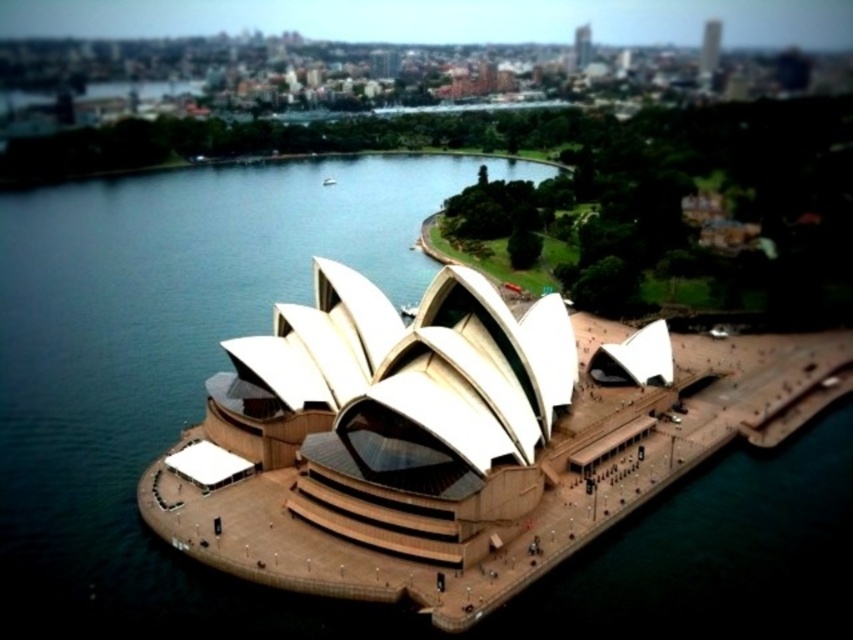
You are a photographer planning to capture the Sydney Opera House and a boat in the foreground. You want to ensure both are visible in your shot. Given that the white fabric opera house at center is wider than the white glossy boat at center, which object should you position closer to the edge of the frame to avoid overcrowding the composition?

Since the white fabric opera house at center is wider than the white glossy boat at center, you should position the white glossy boat at center closer to the edge of the frame to prevent overcrowding and ensure both are visible in the composition.

Based on the photo, you are a photographer planning to capture the Sydney Opera House from an aerial perspective. You notice two boats in the water below the Opera House. The boats are labeled as the white glossy boat at center and the white matte boat at center. Which boat would appear smaller in your photo?

The white glossy boat at center appears smaller in the photo compared to the white matte boat at center, as it has a smaller size according to the description.